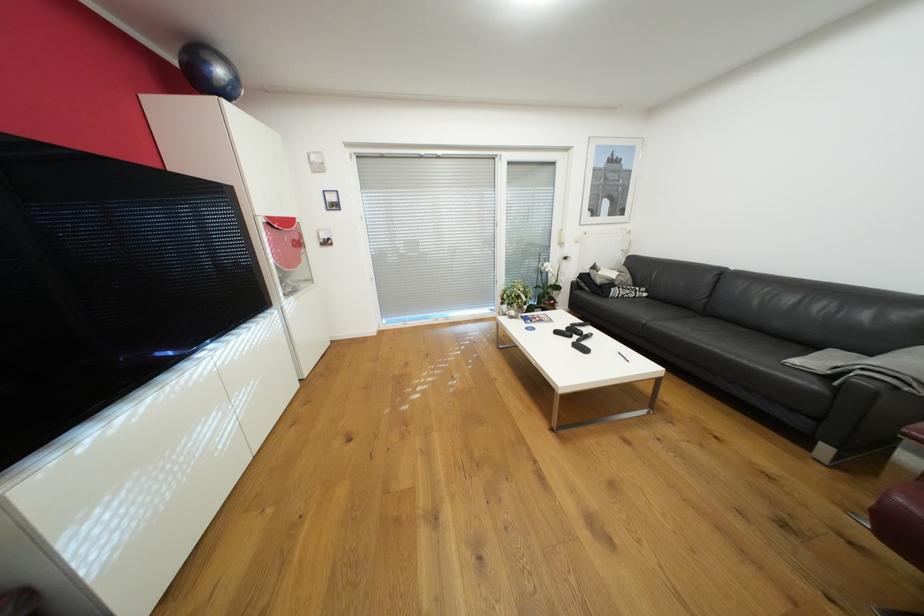
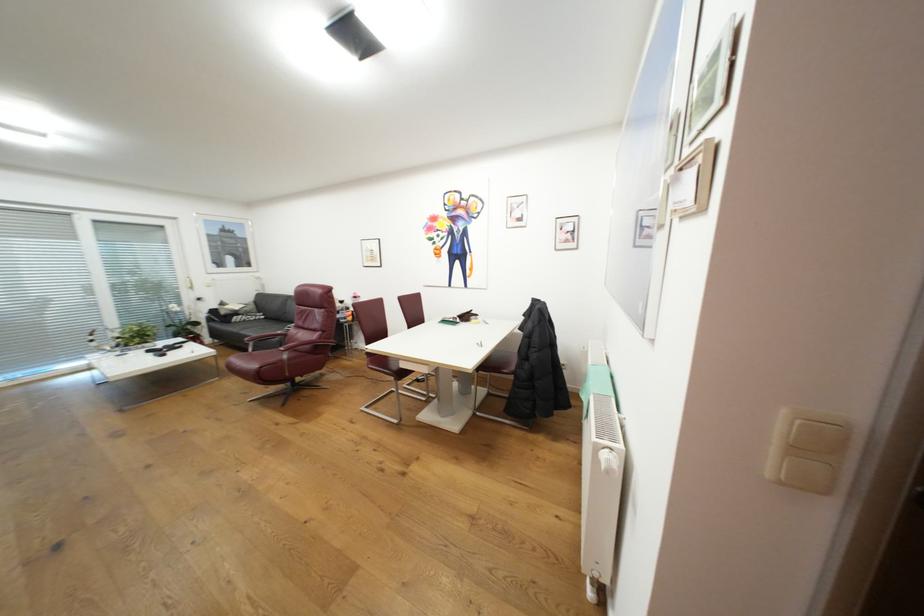
Where in the second image is the point corresponding to the point at 622,292 from the first image?

(244, 318)